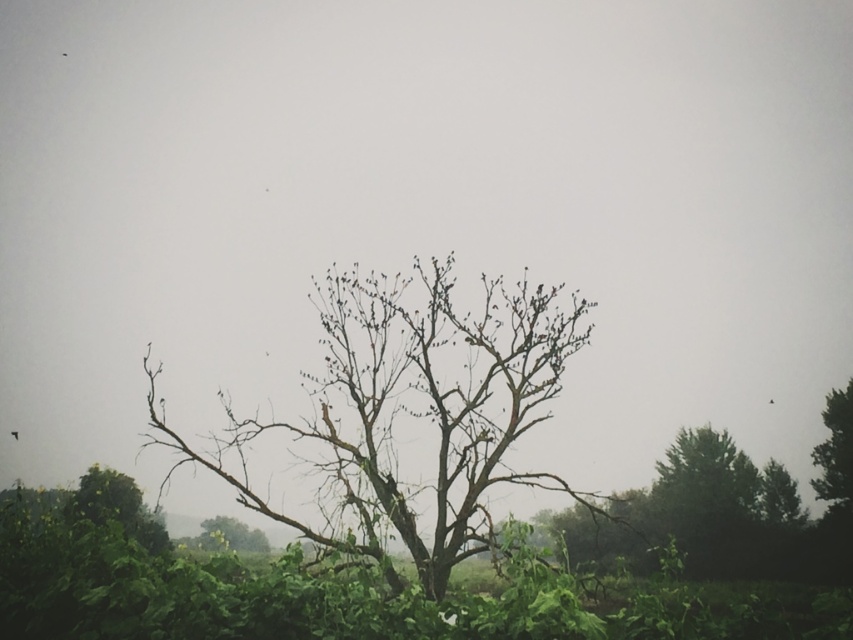
Question: Among these objects, which one is nearest to the camera?

Choices:
 (A) green textured tree at right
 (B) black matte bird at center
 (C) bare branches at center
 (D) green leafy bush at lower left

Answer: (D)

Question: Is green textured tree at right above green matte tree at lower center?

Choices:
 (A) no
 (B) yes

Answer: (B)

Question: Which point is closer to the camera?

Choices:
 (A) bare branches at center
 (B) brown feathered bird at center

Answer: (A)

Question: Does bare branches at center have a lesser width compared to brown feathered bird at center?

Choices:
 (A) yes
 (B) no

Answer: (A)

Question: Is green textured tree at right thinner than green matte tree at lower center?

Choices:
 (A) yes
 (B) no

Answer: (A)

Question: Which point appears farthest from the camera in this image?

Choices:
 (A) (770, 403)
 (B) (834, 486)
 (C) (166, 536)

Answer: (A)